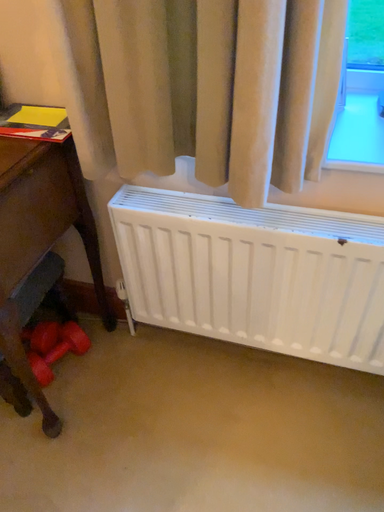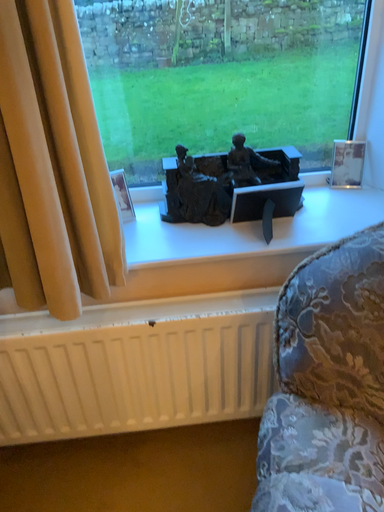
Question: Which way did the camera rotate in the video?

Choices:
 (A) rotated right
 (B) rotated left

Answer: (A)